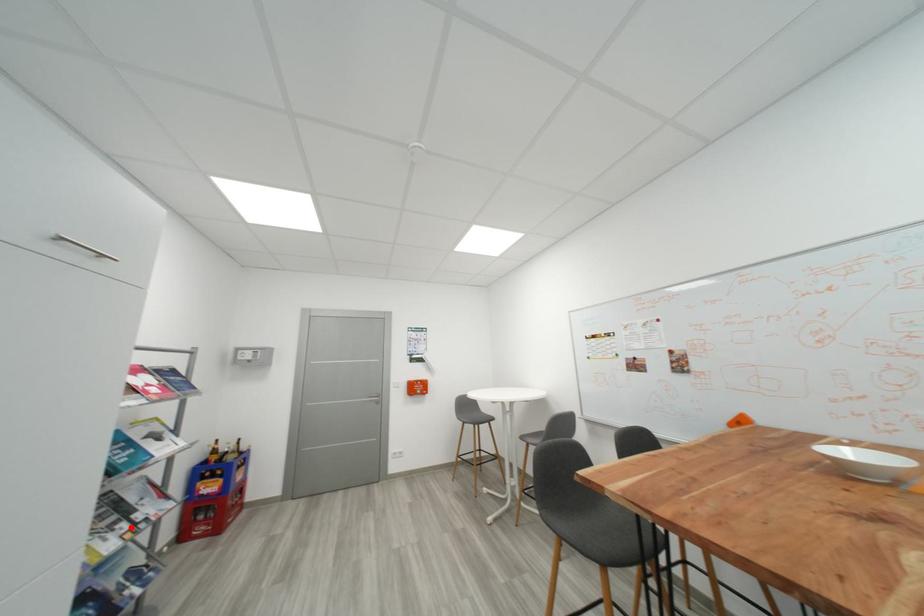
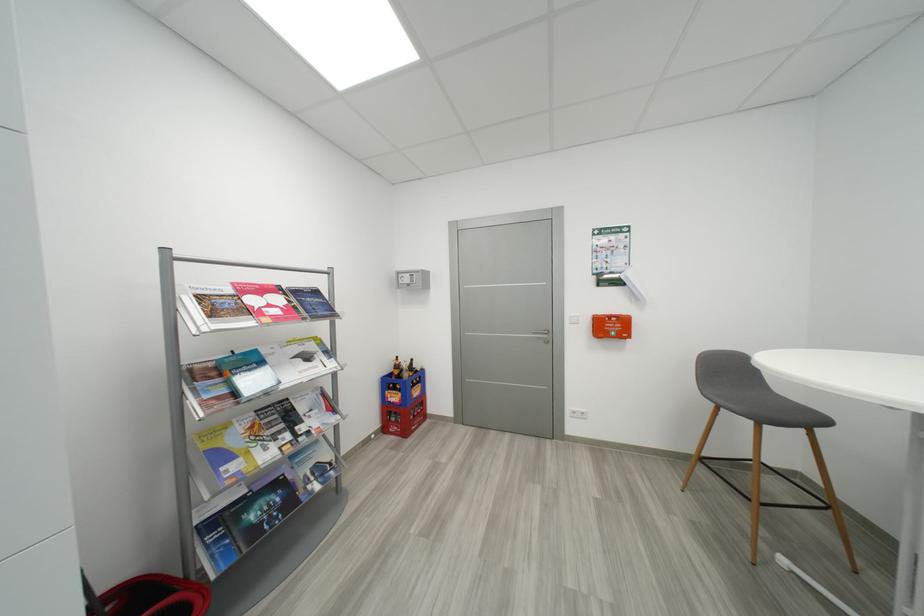
The point at the highlighted location is marked in the first image. Where is the corresponding point in the second image?

(294, 438)